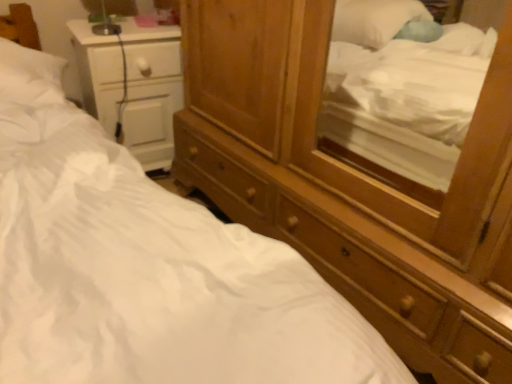
Question: Is wooden dresser at center in front of or behind white glossy nightstand at left in the image?

Choices:
 (A) front
 (B) behind

Answer: (A)

Question: Is point (495, 342) closer or farther from the camera than point (161, 94)?

Choices:
 (A) closer
 (B) farther

Answer: (A)

Question: In terms of height, does wooden dresser at center look taller or shorter compared to white glossy nightstand at left?

Choices:
 (A) short
 (B) tall

Answer: (B)

Question: Based on their positions, is white glossy nightstand at left located to the left or right of wooden dresser at center?

Choices:
 (A) right
 (B) left

Answer: (B)

Question: Does point (152, 41) appear closer or farther from the camera than point (479, 235)?

Choices:
 (A) closer
 (B) farther

Answer: (B)

Question: Is white glossy nightstand at left spatially inside wooden dresser at center, or outside of it?

Choices:
 (A) outside
 (B) inside

Answer: (A)

Question: Considering their positions, is white glossy nightstand at left located in front of or behind wooden dresser at center?

Choices:
 (A) behind
 (B) front

Answer: (A)